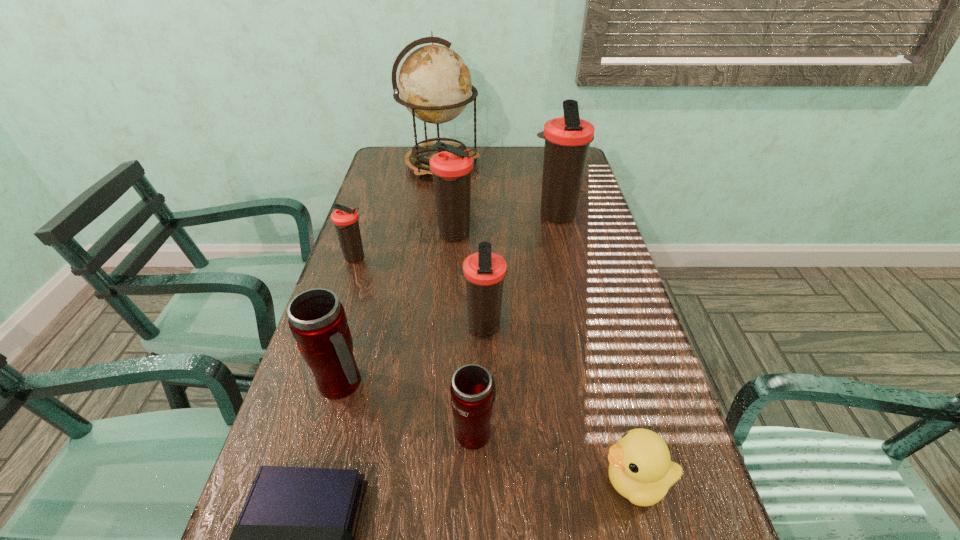
At what (x,y) coordinates should I click in order to perform the action: click on vacant space that's between the tallest thermos bottle and the farthest object. Please return your answer as a coordinate pair (x, y). The image size is (960, 540). Looking at the image, I should click on (498, 190).

In order to click on vacant area that lies between the second nearest brown thermos bottle and the second tallest thermos bottle in this screenshot , I will do `click(405, 247)`.

At what (x,y) coordinates should I click in order to perform the action: click on free space between the right red thermos bottle and the duck. Please return your answer as a coordinate pair (x, y). The image size is (960, 540). Looking at the image, I should click on (555, 457).

You are a GUI agent. You are given a task and a screenshot of the screen. Output one action in this format:
    pyautogui.click(x=<x>, y=<y>)
    Task: Click on the object that stands as the fourth closest to the fourth nearest object
    The width and height of the screenshot is (960, 540).
    Given the screenshot: What is the action you would take?
    pyautogui.click(x=345, y=219)

Identify the location of the second closest object to the bigger red thermos bottle. (473, 390).

Identify which thermos bottle is the sixth closest to the yellow duck. Please provide its 2D coordinates. Your answer should be formatted as a tuple, i.e. [(x, y)], where the tuple contains the x and y coordinates of a point satisfying the conditions above.

[(345, 219)]

You are a GUI agent. You are given a task and a screenshot of the screen. Output one action in this format:
    pyautogui.click(x=<x>, y=<y>)
    Task: Click on the thermos bottle that is the fourth nearest to the duck
    The image size is (960, 540).
    Given the screenshot: What is the action you would take?
    pyautogui.click(x=451, y=169)

At what (x,y) coordinates should I click in order to perform the action: click on brown thermos bottle that can be found as the fourth closest to the farther red thermos bottle. Please return your answer as a coordinate pair (x, y). This screenshot has width=960, height=540. Looking at the image, I should click on (567, 139).

Locate which brown thermos bottle ranks in proximity to the seventh farthest object. Please provide its 2D coordinates. Your answer should be formatted as a tuple, i.e. [(x, y)], where the tuple contains the x and y coordinates of a point satisfying the conditions above.

[(484, 271)]

Identify the location of free spot that satisfies the following two spatial constraints: 1. on the side with the handle of the seventh farthest object; 2. on the right side of the fifth farthest object. (476, 328).